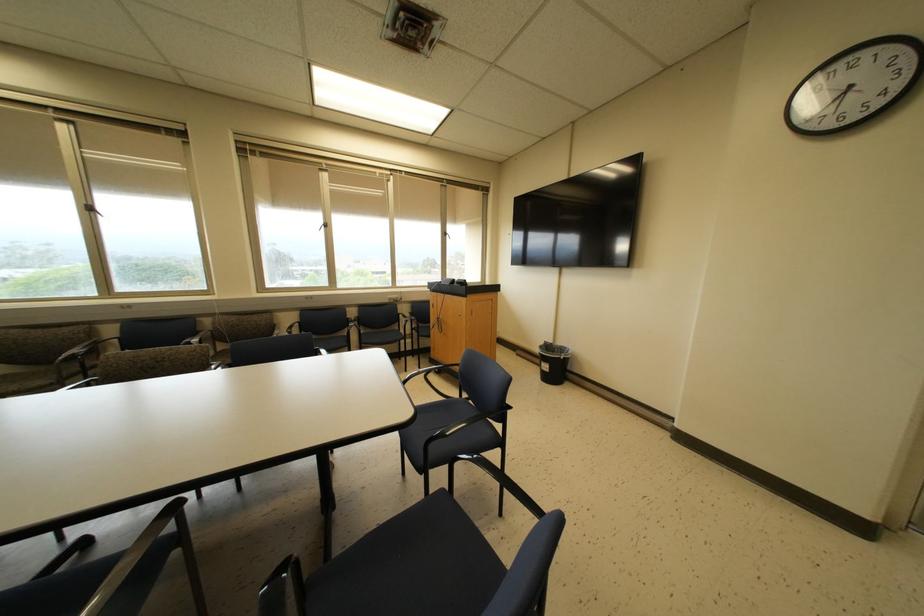
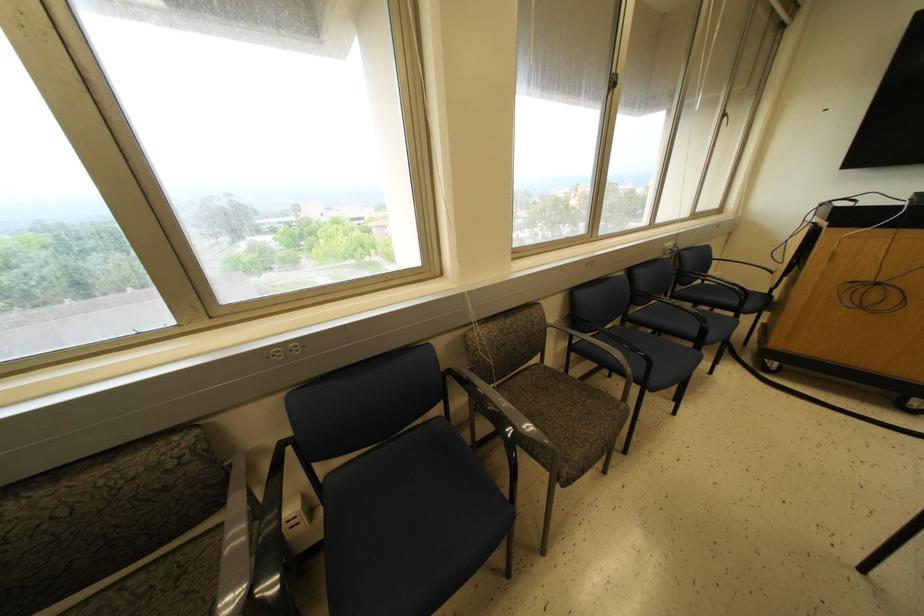
What movement of the cameraman would produce the second image?

The cameraman moved toward left, forward.